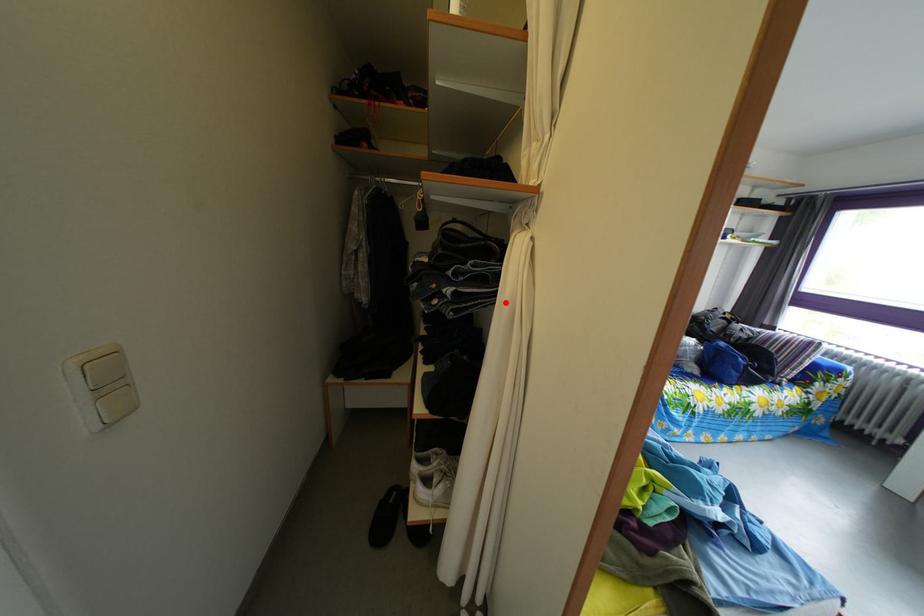
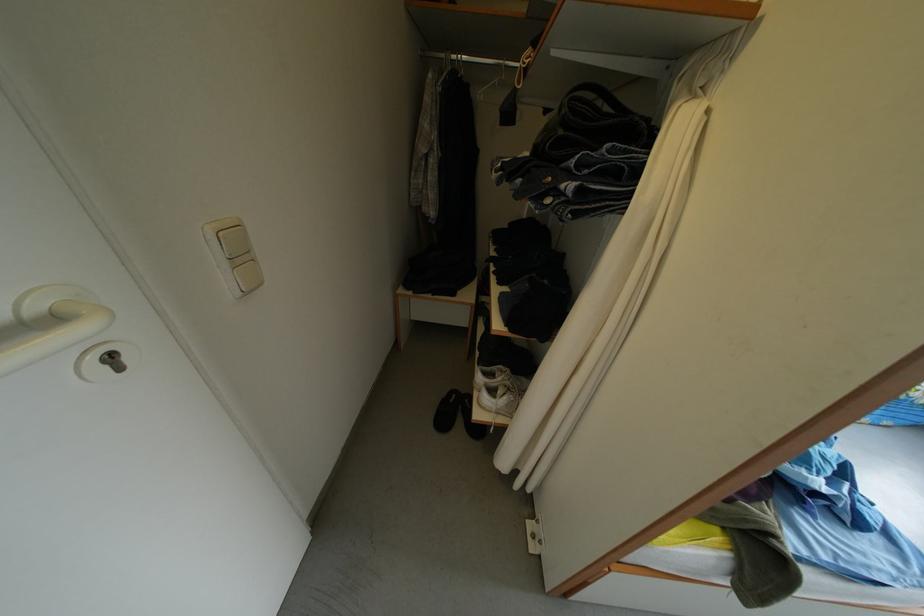
Locate, in the second image, the point that corresponds to the highlighted location in the first image.

(639, 204)